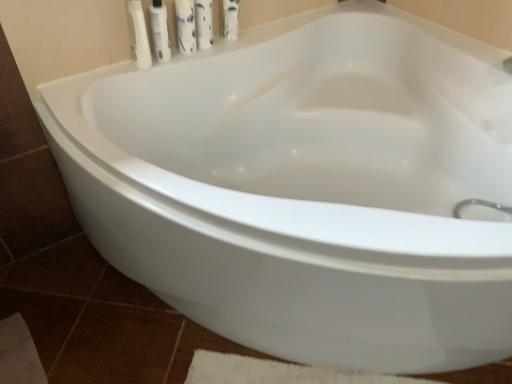
Question: Is white glossy mouthwash at upper center at the back of white glossy bottle at upper left, which is the 2th cleaning product from right to left?

Choices:
 (A) no
 (B) yes

Answer: (A)

Question: Can you confirm if white glossy bottle at upper left, which is the 2th cleaning product from right to left, is taller than white glossy mouthwash at upper center?

Choices:
 (A) no
 (B) yes

Answer: (B)

Question: Does white glossy bottle at upper left, which is the 2th cleaning product from right to left, lie in front of white glossy mouthwash at upper center?

Choices:
 (A) yes
 (B) no

Answer: (A)

Question: Is white glossy bottle at upper left, the first cleaning product when ordered from left to right, at the left side of white glossy mouthwash at upper center?

Choices:
 (A) yes
 (B) no

Answer: (A)

Question: Is white glossy bottle at upper left, the first cleaning product when ordered from left to right, surrounding white glossy mouthwash at upper center?

Choices:
 (A) no
 (B) yes

Answer: (A)

Question: Can you confirm if white glossy bottle at upper left, which is the 2th cleaning product from right to left, is bigger than white glossy mouthwash at upper center?

Choices:
 (A) no
 (B) yes

Answer: (B)

Question: Is white glossy bottle at upper left, the 1th toiletry viewed from the right, facing towards white glossy bottle at upper center, the 2th cleaning product when ordered from left to right?

Choices:
 (A) no
 (B) yes

Answer: (A)

Question: Is white glossy bottle at upper left, the 1th toiletry viewed from the right, next to white glossy bottle at upper center, which is counted as the 1th cleaning product, starting from the right?

Choices:
 (A) yes
 (B) no

Answer: (B)

Question: From a real-world perspective, is white glossy bottle at upper left, the 2th toiletry viewed from the left, on top of white glossy bottle at upper center, which is counted as the 1th cleaning product, starting from the right?

Choices:
 (A) no
 (B) yes

Answer: (A)

Question: Can you confirm if white glossy bottle at upper left, the 1th toiletry viewed from the right, is bigger than white glossy bottle at upper center, the 2th cleaning product when ordered from left to right?

Choices:
 (A) yes
 (B) no

Answer: (B)

Question: Does white glossy bottle at upper left, the 1th toiletry viewed from the right, have a lesser width compared to white glossy bottle at upper center, which is counted as the 1th cleaning product, starting from the right?

Choices:
 (A) no
 (B) yes

Answer: (B)

Question: Considering the relative positions of white glossy bottle at upper left, the 1th toiletry viewed from the right, and white glossy bottle at upper center, the 2th cleaning product when ordered from left to right, in the image provided, is white glossy bottle at upper left, the 1th toiletry viewed from the right, to the right of white glossy bottle at upper center, the 2th cleaning product when ordered from left to right, from the viewer's perspective?

Choices:
 (A) no
 (B) yes

Answer: (A)

Question: Does white glossy mouthwash at upper center have a lesser width compared to white glossy bottle at upper left, the 2th toiletry viewed from the left?

Choices:
 (A) yes
 (B) no

Answer: (B)